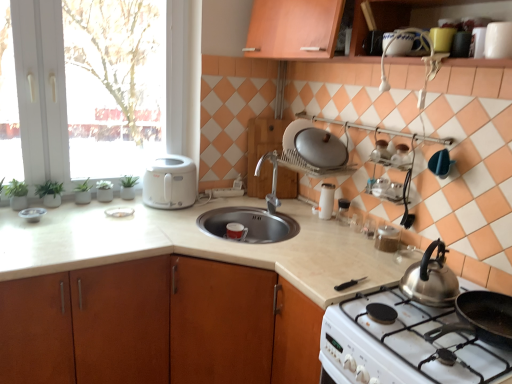
Image resolution: width=512 pixels, height=384 pixels. Identify the location of free space between white plastic toaster at left, placed as the first kitchen appliance when sorted from left to right, and metallic silver bowl at left, which ranks as the first appliance in left-to-right order. (94, 206).